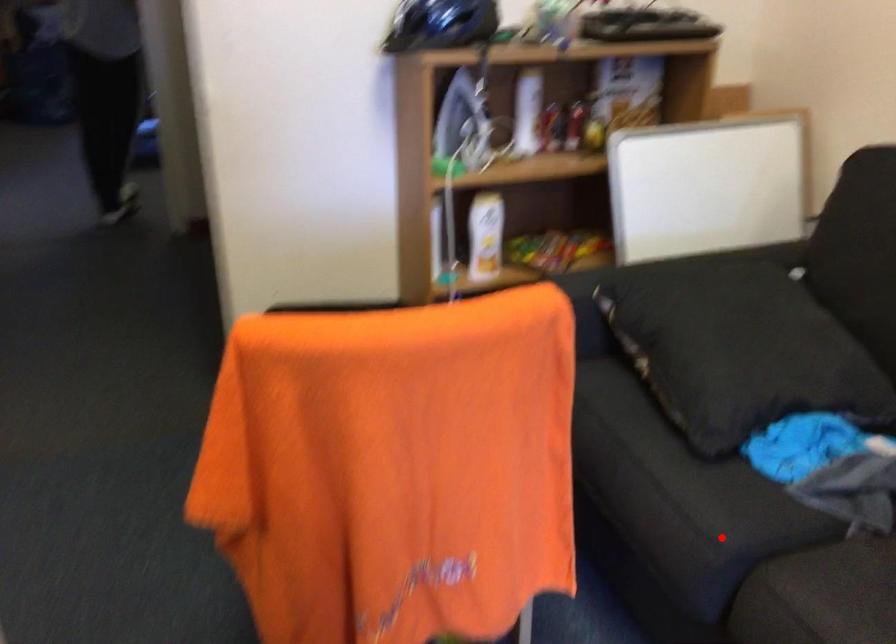
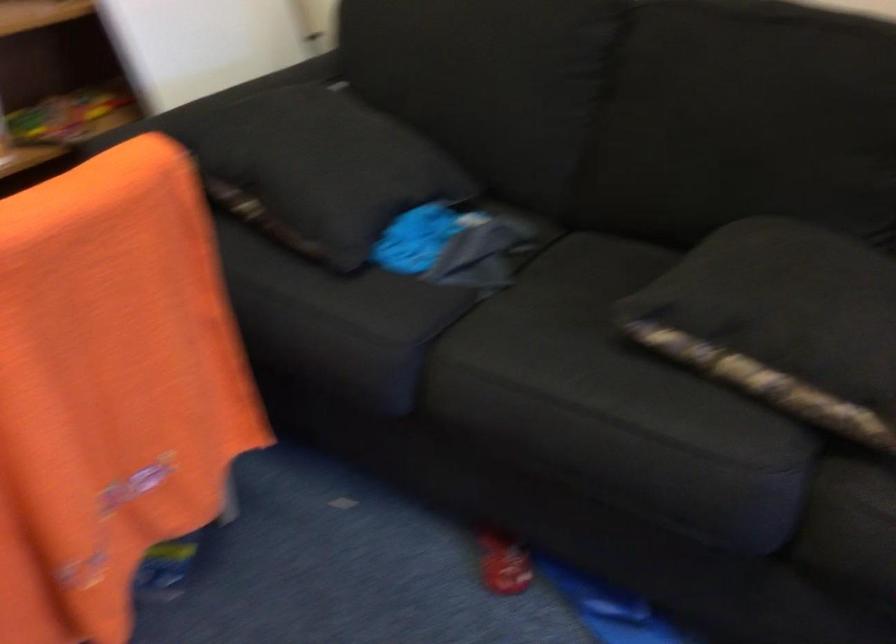
In the second image, find the point that corresponds to the highlighted location in the first image.

(400, 336)